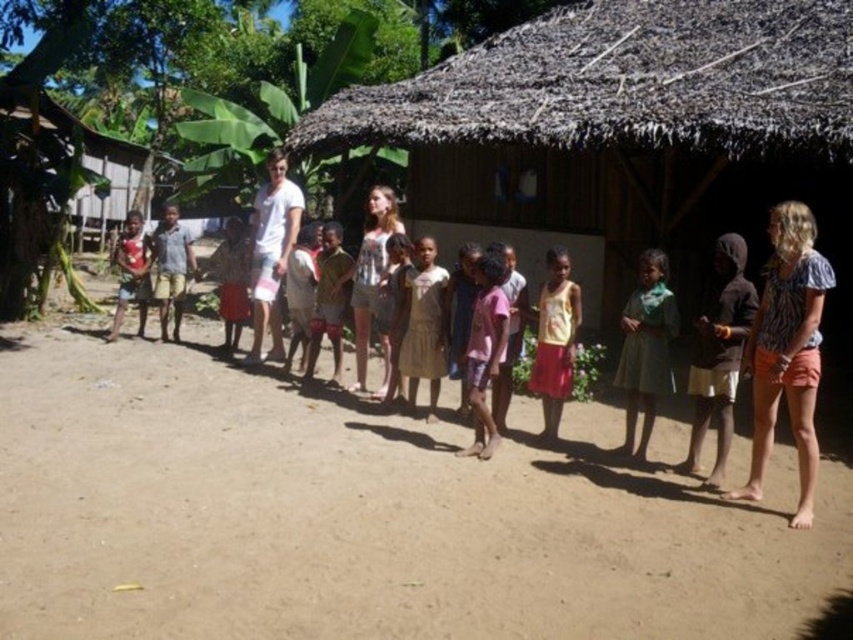
Which of these two, green fabric dress at center or yellow cotton tank top at center, stands taller?

With more height is green fabric dress at center.

Does point (648, 352) lie in front of point (555, 419)?

Yes, point (648, 352) is closer to viewer.

The width and height of the screenshot is (853, 640). I want to click on green fabric dress at center, so click(x=646, y=348).

Is yellow cotton tank top at center positioned before light brown shorts at left?

Yes, it is.

Is point (573, 360) more distant than point (173, 204)?

No, (573, 360) is closer to viewer.

The width and height of the screenshot is (853, 640). I want to click on yellow cotton tank top at center, so click(x=555, y=339).

Can you confirm if green fabric dress at center is bigger than matte red shirt at left?

Actually, green fabric dress at center might be smaller than matte red shirt at left.

At what (x,y) coordinates should I click in order to perform the action: click on green fabric dress at center. Please return your answer as a coordinate pair (x, y). The height and width of the screenshot is (640, 853). Looking at the image, I should click on (646, 348).

This screenshot has width=853, height=640. Identify the location of green fabric dress at center. (646, 348).